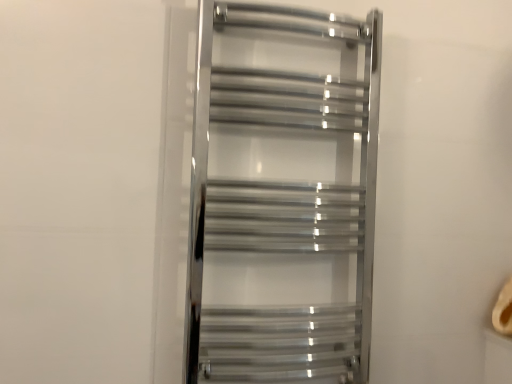
The image size is (512, 384). Describe the element at coordinates (282, 195) in the screenshot. I see `polished chrome towel rack at center` at that location.

The image size is (512, 384). Find the location of `polished chrome towel rack at center`. polished chrome towel rack at center is located at coordinates (282, 195).

In order to face polished chrome towel rack at center, should I rotate leftwards or rightwards?

To face it directly, rotate right by 5.345 degrees.

Where is `polished chrome towel rack at center`? polished chrome towel rack at center is located at coordinates (282, 195).